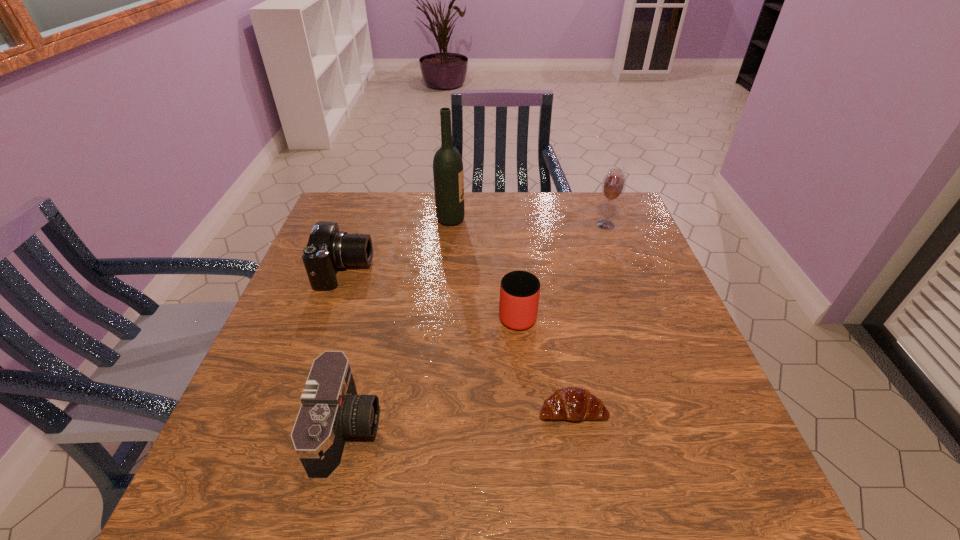
The width and height of the screenshot is (960, 540). What are the coordinates of `object situated at the right edge` in the screenshot? It's located at (613, 186).

Locate an element on the screen. object at the far right corner is located at coordinates (613, 186).

Locate an element on the screen. The width and height of the screenshot is (960, 540). vacant region at the far edge of the desktop is located at coordinates (529, 201).

This screenshot has width=960, height=540. In order to click on vacant space at the near edge of the desktop in this screenshot , I will do `click(638, 480)`.

Identify the location of vacant space at the left edge of the desktop. This screenshot has width=960, height=540. (316, 329).

Find the location of a particular element. This screenshot has height=540, width=960. vacant space at the right edge of the desktop is located at coordinates (638, 291).

Identify the location of vacant point at the far left corner. The width and height of the screenshot is (960, 540). (342, 213).

Image resolution: width=960 pixels, height=540 pixels. I want to click on vacant area between the fourth farthest object and the rightmost object, so click(x=562, y=269).

Locate an element on the screen. This screenshot has width=960, height=540. empty space between the nearer camera and the wine bottle is located at coordinates (399, 325).

Identify the location of blank region between the fourth nearest object and the third nearest object. The height and width of the screenshot is (540, 960). (431, 292).